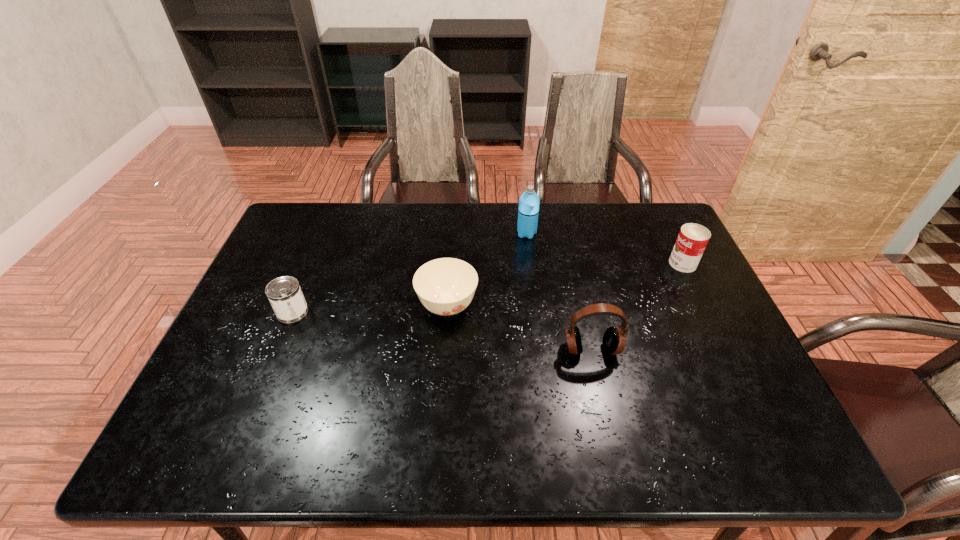
The width and height of the screenshot is (960, 540). I want to click on the third object from left to right, so click(x=528, y=210).

I want to click on thermos bottle, so click(528, 210).

Locate an element on the screen. The width and height of the screenshot is (960, 540). the fourth object from left to right is located at coordinates (614, 339).

The image size is (960, 540). I want to click on the second tallest object, so point(614,339).

Identify the location of the taller can. (692, 240).

At what (x,y) coordinates should I click in order to perform the action: click on the farther can. Please return your answer as a coordinate pair (x, y). Image resolution: width=960 pixels, height=540 pixels. Looking at the image, I should click on (692, 240).

The image size is (960, 540). I want to click on the fourth object from right to left, so click(x=446, y=286).

The height and width of the screenshot is (540, 960). Identify the location of the leftmost object. (284, 293).

This screenshot has width=960, height=540. I want to click on the shorter can, so click(284, 293).

You are a GUI agent. You are given a task and a screenshot of the screen. Output one action in this format:
    pyautogui.click(x=<x>, y=<y>)
    Task: Click on the vacant space situated on the back of the thermos bottle
    
    Given the screenshot: What is the action you would take?
    pyautogui.click(x=524, y=212)